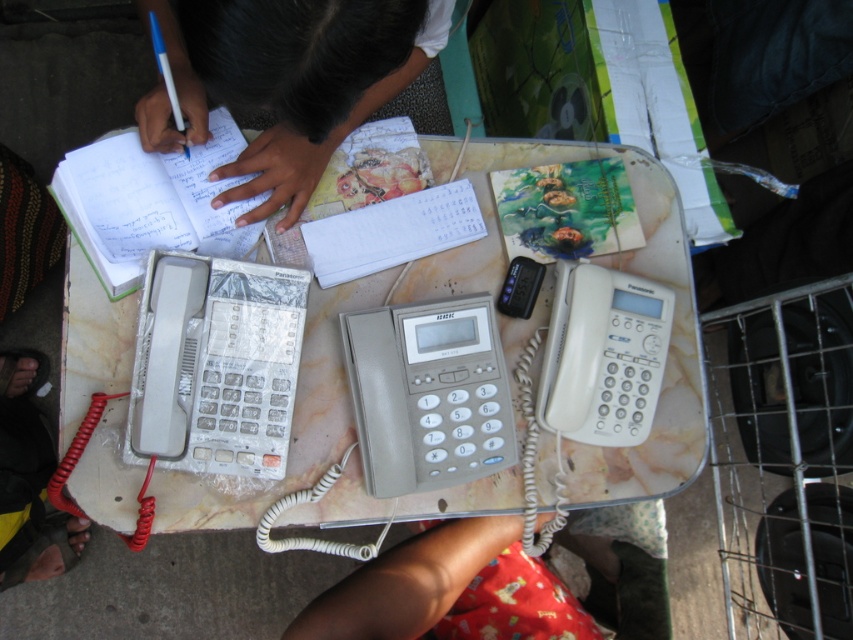
You are setting up a new calculator on the table. The clear plastic calculator at left needs to be placed exactly 5 inches away from the marble table at center. Is the current placement correct?

The marble table at center is 5.22 inches from clear plastic calculator at left, which is slightly more than 5 inches. Therefore, the current placement is not correct. You should move the clear plastic calculator at left closer to the marble table at center by 0.22 inches to achieve the desired distance.

You are setting up a new phone on the marble table at center. The black plastic phone at center is already placed. What should you consider about the table size?

The marble table at center is wider than the black plastic phone at center, so there is enough space to place the new phone.

You are setting up a phone on the marble table at center. The black plastic phone at center needs to be placed so that it doesn

The marble table at center has a greater height compared to the black plastic phone at center, so the phone can be placed on the table without any issues since the table is taller than the phone.